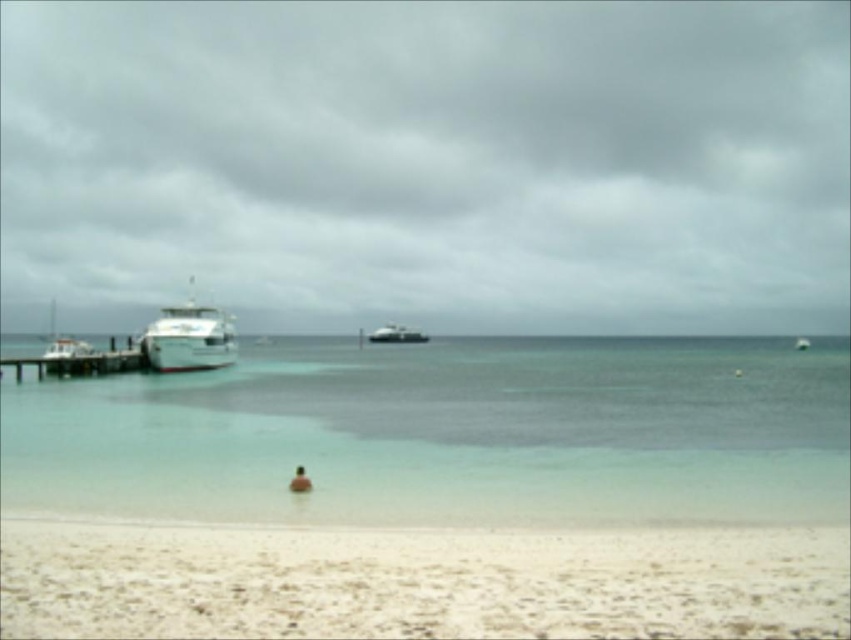
Question: Considering the real-world distances, which object is farthest from the smooth skin person at center?

Choices:
 (A) metallic silver boat at center
 (B) clear water at center
 (C) white wood dock at left
 (D) white glossy boat at left

Answer: (A)

Question: Can you confirm if white sandy beach at lower center is positioned to the right of white glossy boat at left?

Choices:
 (A) yes
 (B) no

Answer: (A)

Question: Which of these objects is positioned farthest from the clear water at center?

Choices:
 (A) white sandy beach at lower center
 (B) white wood dock at left
 (C) metallic silver boat at center

Answer: (C)

Question: Is metallic silver boat at center positioned in front of smooth skin person at center?

Choices:
 (A) no
 (B) yes

Answer: (A)

Question: Among these objects, which one is farthest from the camera?

Choices:
 (A) clear water at center
 (B) white wood dock at left

Answer: (B)

Question: Can you confirm if white sandy beach at lower center is smaller than white wood dock at left?

Choices:
 (A) no
 (B) yes

Answer: (B)